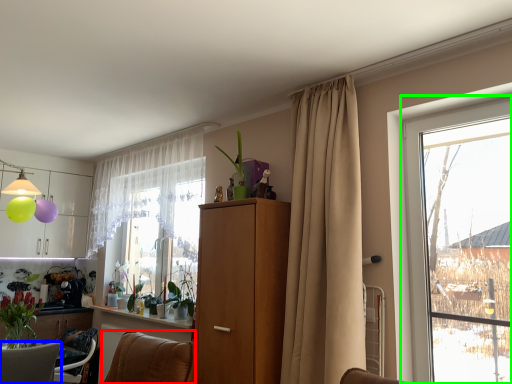
Question: Based on their relative distances, which object is nearer to furniture (highlighted by a red box)? Choose from furniture (highlighted by a blue box) and window (highlighted by a green box).

Choices:
 (A) furniture
 (B) window

Answer: (A)